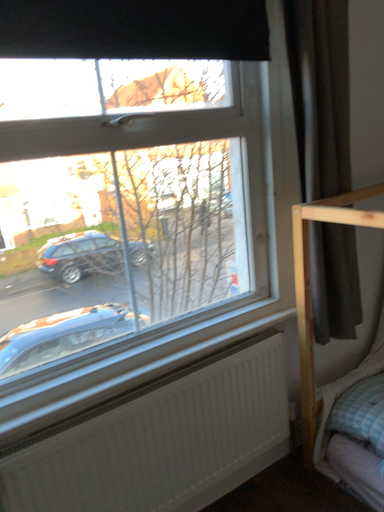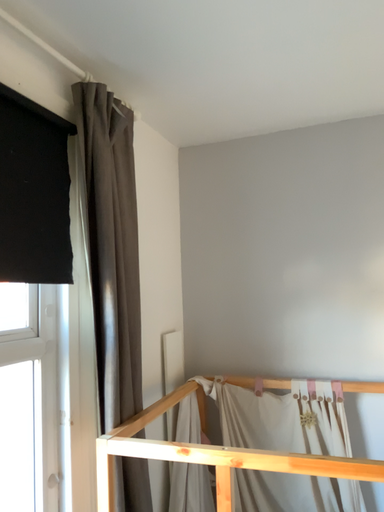
Question: How did the camera likely rotate when shooting the video?

Choices:
 (A) rotated left
 (B) rotated right

Answer: (B)